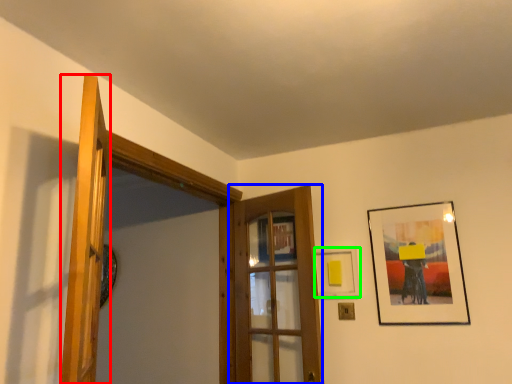
Question: Based on their relative distances, which object is nearer to door (highlighted by a red box)? Choose from door (highlighted by a blue box) and picture frame (highlighted by a green box).

Choices:
 (A) door
 (B) picture frame

Answer: (A)